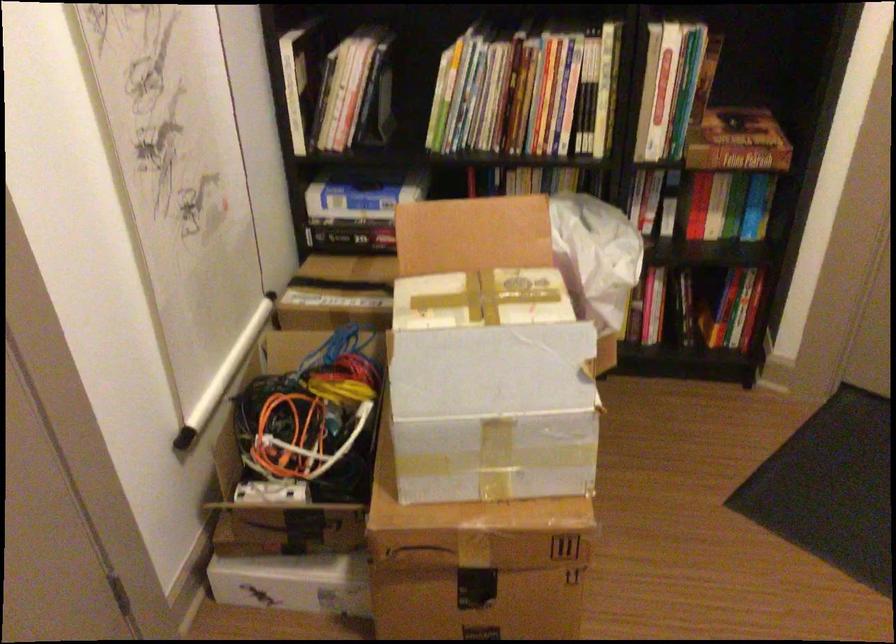
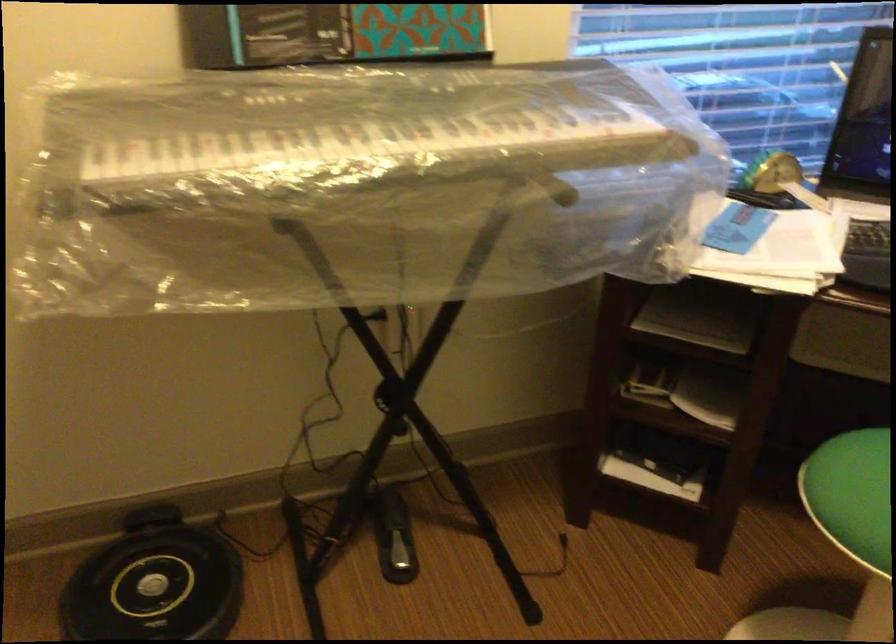
First-person continuous shooting, in which direction is the camera rotating?

The camera rotated toward right-down.